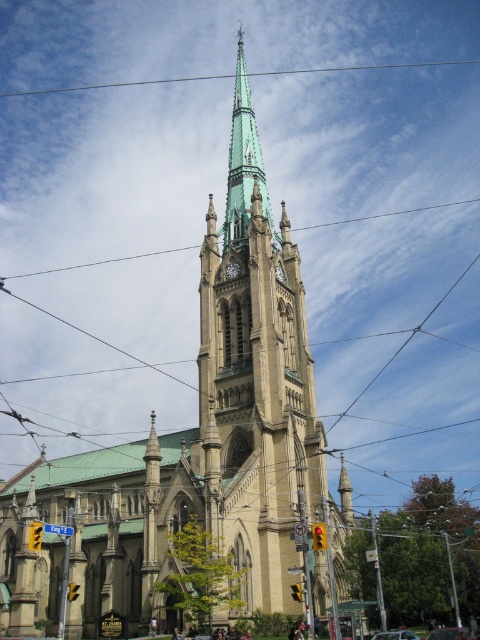
You are a city planner assessing the view of the beige stone church at center and the green glazed steeple at center from a new building proposal. Which structure would be visible first when looking from the street level upwards?

The green glazed steeple at center would be visible first when looking from street level upwards because it is located above the beige stone church at center.

You are a city planner reviewing the church design. The city requires all spires to be visible above any adjacent structures. Based on the image, is the green glass spire at center positioned above the green glazed steeple at center?

The green glass spire at center is located above the green glazed steeple at center, so it meets the city requirement of being visible above adjacent structures.

You are standing in front of the Gothic church and want to take a photo that includes both the spire and the traffic lights. You notice two points marked on your map at coordinates point (276, 557) and point (243, 195). Which point should you stand at to ensure both the spire and the traffic lights are in frame without needing to move your camera position?

You should stand at point (276, 557) because it is closer to the viewer, allowing both the spire and the traffic lights to be captured in the frame without needing to adjust the camera position.